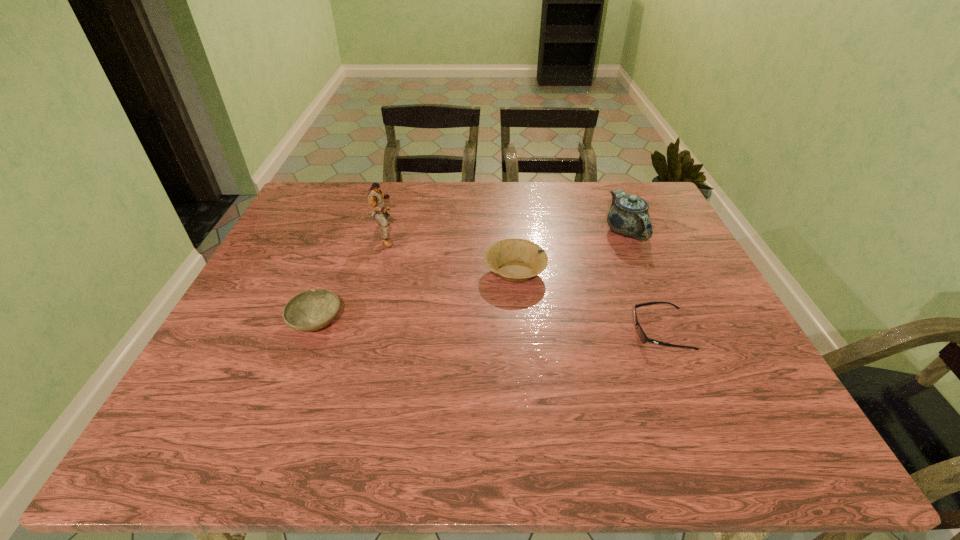
Image resolution: width=960 pixels, height=540 pixels. What are the coordinates of `free area in between the sunglasses and the nearer bowl` in the screenshot? It's located at (489, 327).

I want to click on free space between the fourth shortest object and the third object from left to right, so point(570,252).

This screenshot has height=540, width=960. Find the location of `free spot between the tallest object and the nearer bowl`. free spot between the tallest object and the nearer bowl is located at coordinates (350, 278).

Identify the location of vacant space in between the second object from left to right and the nearer bowl. The height and width of the screenshot is (540, 960). (350, 278).

Where is `unoccupied position between the chinaware and the third object from left to right`? unoccupied position between the chinaware and the third object from left to right is located at coordinates (570, 252).

The width and height of the screenshot is (960, 540). What are the coordinates of `vacant area between the second tallest object and the sunglasses` in the screenshot? It's located at (643, 281).

Select which object appears as the third closest to the third nearest object. Please provide its 2D coordinates. Your answer should be formatted as a tuple, i.e. [(x, y)], where the tuple contains the x and y coordinates of a point satisfying the conditions above.

[(375, 196)]

This screenshot has width=960, height=540. Find the location of `the closest object to the sunglasses`. the closest object to the sunglasses is located at coordinates tap(516, 260).

Where is `free location that satisfies the following two spatial constraints: 1. on the back side of the leftmost object; 2. on the right side of the third nearest object`? The image size is (960, 540). free location that satisfies the following two spatial constraints: 1. on the back side of the leftmost object; 2. on the right side of the third nearest object is located at coordinates (335, 272).

Image resolution: width=960 pixels, height=540 pixels. Identify the location of free location that satisfies the following two spatial constraints: 1. from the spout of the fourth shortest object; 2. on the front-facing side of the shortest object. (668, 332).